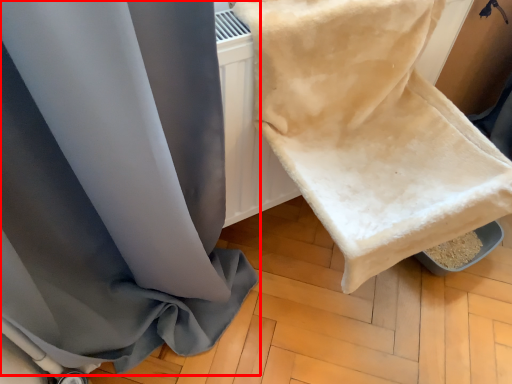
Question: In this image, where is curtain (annotated by the red box) located relative to towel?

Choices:
 (A) left
 (B) right

Answer: (A)